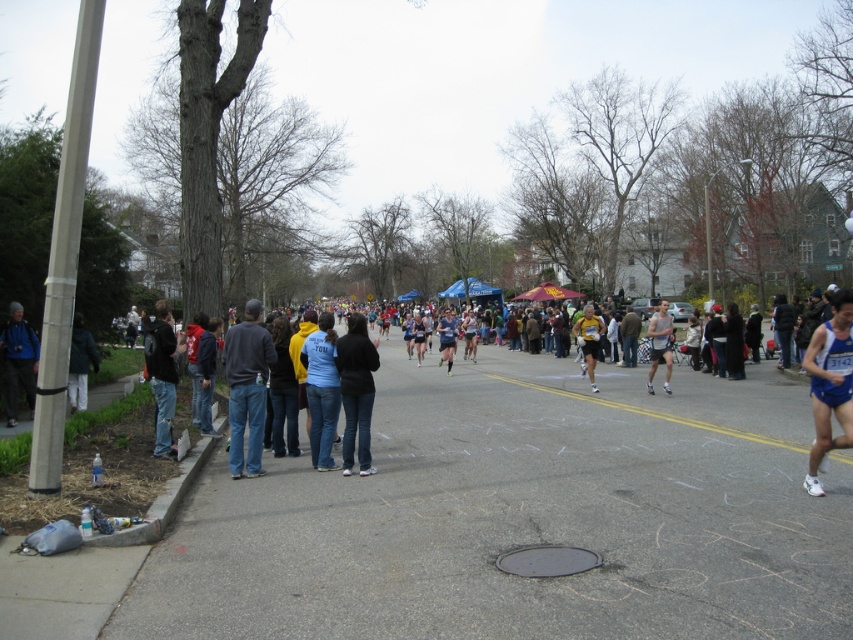
Between matte blue jacket at left and matte gray tank top at center, which one appears on the right side from the viewer's perspective?

matte gray tank top at center

Find the location of `matte blue jacket at left`. matte blue jacket at left is located at coordinates (18, 362).

In the scene shown: Can you confirm if dark blue jeans at center is shorter than matte gray tank top at center?

Yes, dark blue jeans at center is shorter than matte gray tank top at center.

Is point (364, 460) closer to viewer compared to point (659, 332)?

Yes.

Between point (367, 422) and point (664, 348), which one is positioned behind?

Point (664, 348)

Find the location of a particular element. dark blue jeans at center is located at coordinates (357, 390).

Is blue fabric runner at right bigger than matte blue jacket at left?

No.

Is blue fabric runner at right further to the viewer compared to matte blue jacket at left?

No.

Between point (850, 298) and point (32, 372), which one is positioned in front?

Point (850, 298) is in front.

Where is `blue fabric runner at right`? This screenshot has height=640, width=853. blue fabric runner at right is located at coordinates (830, 384).